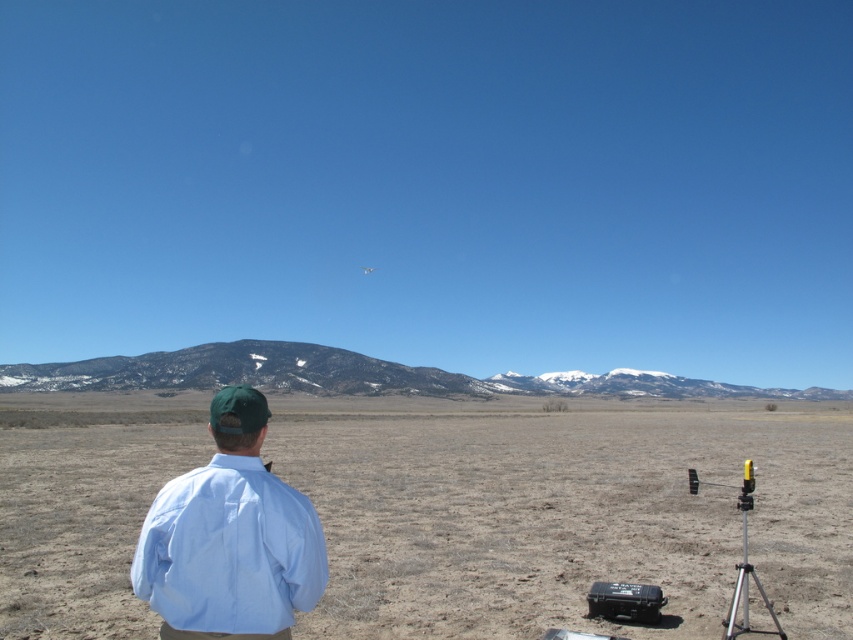
Question: Which object is farther from the camera taking this photo?

Choices:
 (A) brown/dry grass at center
 (B) silver metallic tripod at lower right
 (C) light blue cotton shirt at center

Answer: (B)

Question: From the image, what is the correct spatial relationship of brown/dry grass at center in relation to light blue cotton shirt at center?

Choices:
 (A) above
 (B) below

Answer: (B)

Question: Which point is farther to the camera?

Choices:
 (A) brown/dry grass at center
 (B) silver metallic tripod at lower right
 (C) light blue cotton shirt at center

Answer: (B)

Question: Which point is farther from the camera taking this photo?

Choices:
 (A) pos(753,572)
 (B) pos(235,435)
 (C) pos(346,483)

Answer: (C)

Question: Can you confirm if brown/dry grass at center is positioned to the left of light blue cotton shirt at center?

Choices:
 (A) no
 (B) yes

Answer: (A)

Question: Can you confirm if brown/dry grass at center is wider than silver metallic tripod at lower right?

Choices:
 (A) yes
 (B) no

Answer: (A)